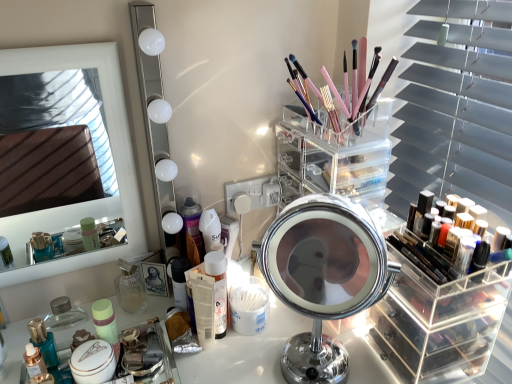
Question: Is point (458, 349) closer or farther from the camera than point (419, 216)?

Choices:
 (A) closer
 (B) farther

Answer: (B)

Question: From a real-world perspective, relative to shiny black nail polish at right, marked as the 1th toiletry in a right-to-left arrangement, is clear acrylic makeup organizer at right, acting as the second shelf starting from the left, vertically above or below?

Choices:
 (A) above
 (B) below

Answer: (B)

Question: Based on their relative distances, which object is nearer to the shiny metallic perfume at lower left, the 4th toiletry viewed from the right?

Choices:
 (A) clear glass perfume at center, the third toiletry from the right
 (B) clear acrylic organizer at center, placed as the first shelf when sorted from top to bottom
 (C) matte plastic lotion at center, the 2th toiletry from the right
 (D) white glossy mirror at upper left, the second mirror viewed from the left
 (E) clear acrylic makeup organizer at right, marked as the 1th shelf in a bottom-to-top arrangement

Answer: (A)

Question: Which is nearer to the chrome/metallic mirror at center, marked as the third mirror in a left-to-right arrangement?

Choices:
 (A) clear acrylic organizer at center, marked as the 2th shelf in a right-to-left arrangement
 (B) matte plastic lotion at center, the third toiletry from the left
 (C) white glossy mirror at upper left, the 2th mirror from the right
 (D) shiny black nail polish at right, marked as the 1th toiletry in a right-to-left arrangement
 (E) shiny metallic perfume at lower left, the 4th toiletry viewed from the right

Answer: (D)